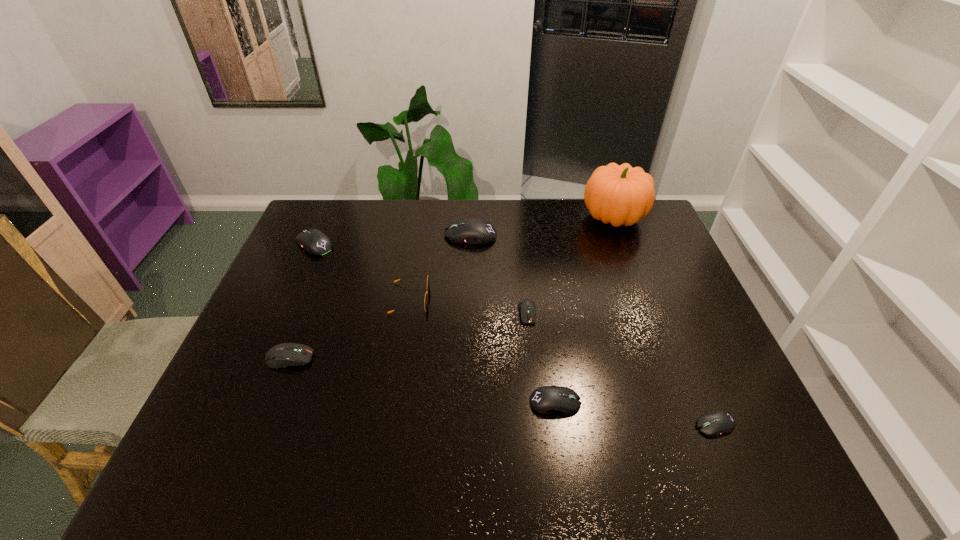
Find the location of a particular element. The height and width of the screenshot is (540, 960). free space that satisfies the following two spatial constraints: 1. on the button of the smaller dark computer equipment; 2. on the right side of the rightmost black computer equipment is located at coordinates (540, 425).

Where is `blank space that satisfies the following two spatial constraints: 1. on the back side of the third black computer equipment from left to right; 2. on the front-facing side of the sixth object from right to left`? blank space that satisfies the following two spatial constraints: 1. on the back side of the third black computer equipment from left to right; 2. on the front-facing side of the sixth object from right to left is located at coordinates (540, 299).

Where is `blank area in the image that satisfies the following two spatial constraints: 1. on the front side of the rightmost black computer equipment; 2. on the left side of the third black computer equipment from right to left`? The image size is (960, 540). blank area in the image that satisfies the following two spatial constraints: 1. on the front side of the rightmost black computer equipment; 2. on the left side of the third black computer equipment from right to left is located at coordinates (466, 425).